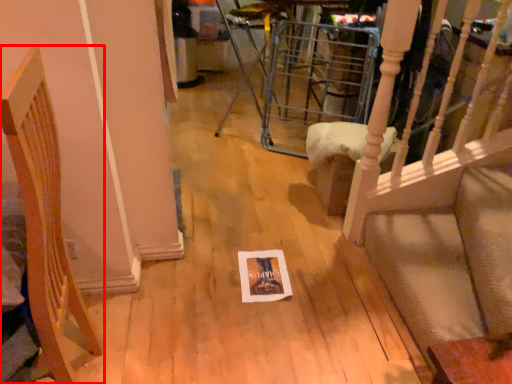
Question: Considering the relative positions of furniture (annotated by the red box) and furniture in the image provided, where is furniture (annotated by the red box) located with respect to the staircase?

Choices:
 (A) left
 (B) right

Answer: (A)